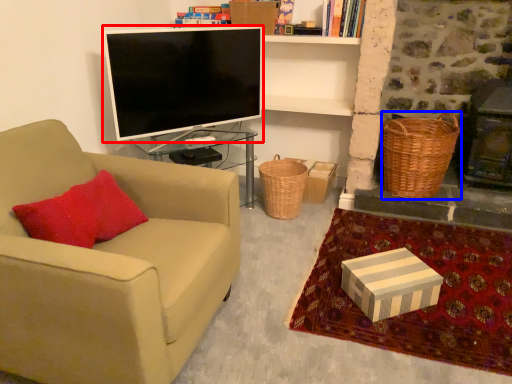
Question: Among these objects, which one is farthest to the camera, television (highlighted by a red box) or picnic basket (highlighted by a blue box)?

Choices:
 (A) television
 (B) picnic basket

Answer: (B)